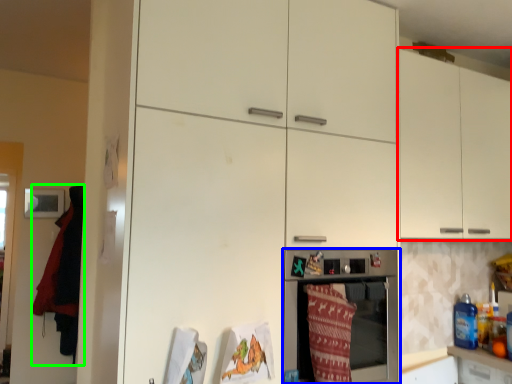
Question: Which is farther away from cabinetry (highlighted by a red box)? home appliance (highlighted by a blue box) or blanket (highlighted by a green box)?

Choices:
 (A) home appliance
 (B) blanket

Answer: (B)